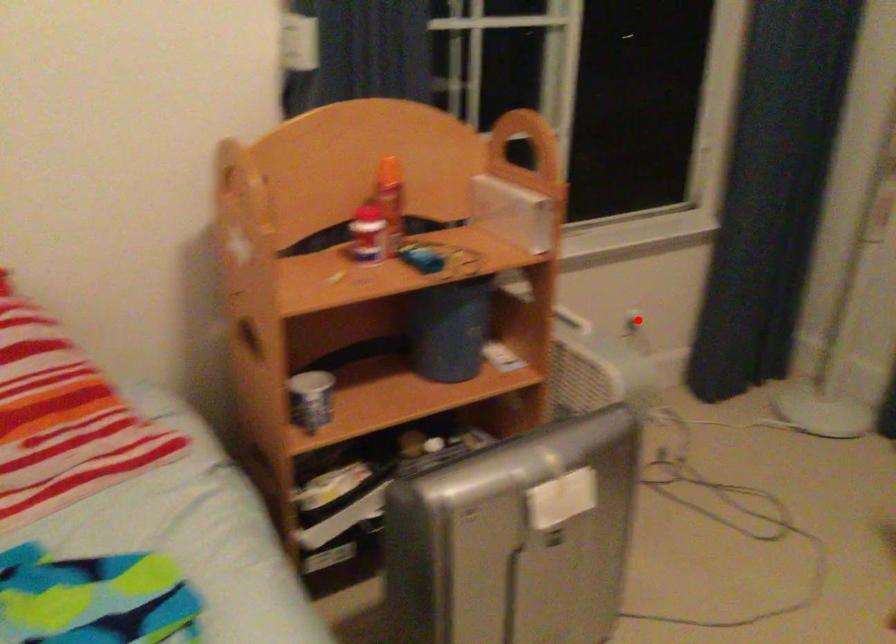
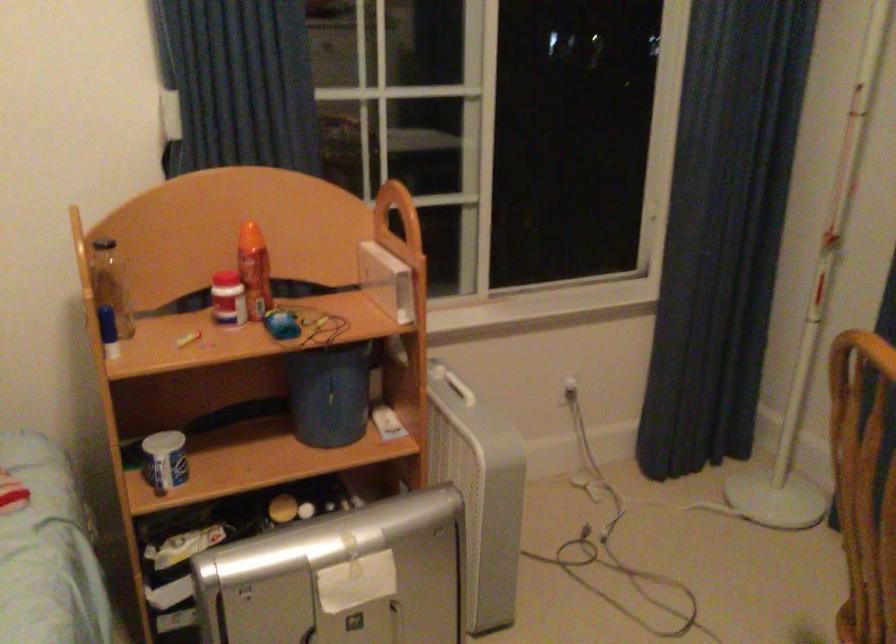
The point at the highlighted location is marked in the first image. Where is the corresponding point in the second image?

(564, 392)